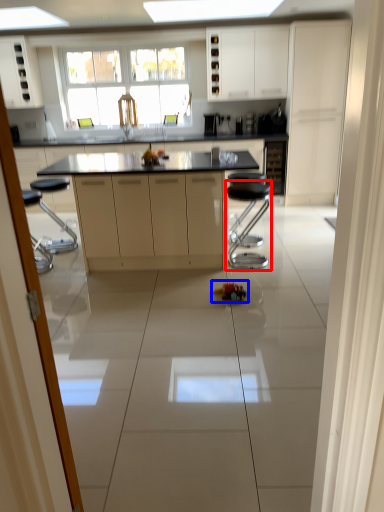
Question: Which object appears closest to the camera in this image, bar stool (highlighted by a red box) or toy (highlighted by a blue box)?

Choices:
 (A) bar stool
 (B) toy

Answer: (B)